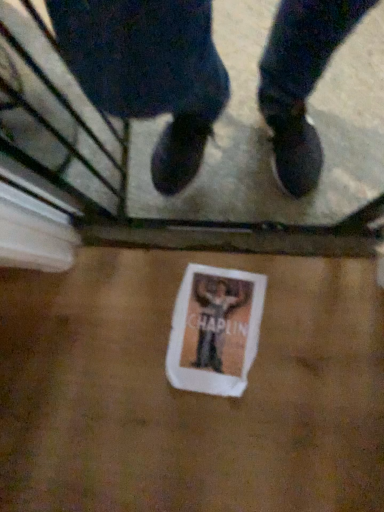
The height and width of the screenshot is (512, 384). What do you see at coordinates (215, 330) in the screenshot?
I see `white paper flyer at center` at bounding box center [215, 330].

Measure the distance between white paper flyer at center and camera.

The distance of white paper flyer at center from camera is 38.30 inches.

In order to click on white paper flyer at center in this screenshot , I will do (x=215, y=330).

What do you see at coordinates (149, 71) in the screenshot? This screenshot has width=384, height=512. I see `matte black shoes at center` at bounding box center [149, 71].

Where is `matte black shoes at center`? This screenshot has height=512, width=384. matte black shoes at center is located at coordinates (149, 71).

The width and height of the screenshot is (384, 512). In order to click on white paper flyer at center in this screenshot , I will do `click(215, 330)`.

Between matte black shoes at center and white paper flyer at center, which one appears on the right side from the viewer's perspective?

matte black shoes at center.

Is matte black shoes at center in front of or behind white paper flyer at center in the image?

In the image, matte black shoes at center appears in front of white paper flyer at center.

Which point is more forward, (176, 70) or (201, 326)?

Point (176, 70)

From the image's perspective, which one is positioned lower, matte black shoes at center or white paper flyer at center?

white paper flyer at center.

From a real-world perspective, is matte black shoes at center positioned over white paper flyer at center based on gravity?

Yes.

Is matte black shoes at center wider than white paper flyer at center?

Incorrect, the width of matte black shoes at center does not surpass that of white paper flyer at center.

Is matte black shoes at center shorter than white paper flyer at center?

Incorrect, the height of matte black shoes at center does not fall short of that of white paper flyer at center.

Is matte black shoes at center bigger than white paper flyer at center?

Indeed, matte black shoes at center has a larger size compared to white paper flyer at center.

Can white paper flyer at center be found inside matte black shoes at center?

No, white paper flyer at center is not surrounded by matte black shoes at center.

Is matte black shoes at center far away from white paper flyer at center?

They are positioned close to each other.

Is matte black shoes at center looking in the opposite direction of white paper flyer at center?

That's right, matte black shoes at center is facing away from white paper flyer at center.

How different are the orientations of matte black shoes at center and white paper flyer at center in degrees?

4.92 degrees separate the facing orientations of matte black shoes at center and white paper flyer at center.

At what (x,y) coordinates should I click in order to perform the action: click on person to the right of white paper flyer at center. Please return your answer as a coordinate pair (x, y). Image resolution: width=384 pixels, height=512 pixels. Looking at the image, I should click on (149, 71).

Is white paper flyer at center to the left of matte black shoes at center from the viewer's perspective?

Yes, white paper flyer at center is to the left of matte black shoes at center.

Is white paper flyer at center further to the viewer compared to matte black shoes at center?

Yes.

Which is behind, point (242, 331) or point (100, 0)?

The point (242, 331) is farther from the camera.

From the image's perspective, which is below, white paper flyer at center or matte black shoes at center?

white paper flyer at center appears lower in the image.

From a real-world perspective, who is located lower, white paper flyer at center or matte black shoes at center?

white paper flyer at center.

Considering the relative sizes of white paper flyer at center and matte black shoes at center in the image provided, is white paper flyer at center thinner than matte black shoes at center?

No, white paper flyer at center is not thinner than matte black shoes at center.

Considering the relative sizes of white paper flyer at center and matte black shoes at center in the image provided, is white paper flyer at center taller than matte black shoes at center?

In fact, white paper flyer at center may be shorter than matte black shoes at center.

Considering the sizes of white paper flyer at center and matte black shoes at center in the image, is white paper flyer at center bigger or smaller than matte black shoes at center?

Considering their sizes, white paper flyer at center takes up less space than matte black shoes at center.

Is white paper flyer at center positioned beyond the bounds of matte black shoes at center?

white paper flyer at center is positioned outside matte black shoes at center.

Is white paper flyer at center placed right next to matte black shoes at center?

No, white paper flyer at center is not beside matte black shoes at center.

Is white paper flyer at center aimed at matte black shoes at center?

No.

What's the angular difference between white paper flyer at center and matte black shoes at center's facing directions?

The facing directions of white paper flyer at center and matte black shoes at center are 4.92 degrees apart.

Measure the distance between white paper flyer at center and matte black shoes at center.

A distance of 38.39 centimeters exists between white paper flyer at center and matte black shoes at center.

You are a GUI agent. You are given a task and a screenshot of the screen. Output one action in this format:
    pyautogui.click(x=<x>, y=<y>)
    Task: Click on the person located above the white paper flyer at center (from the image's perspective)
    This screenshot has height=512, width=384.
    Given the screenshot: What is the action you would take?
    pyautogui.click(x=149, y=71)

Find the location of a particular element. The image size is (384, 512). flyer behind the matte black shoes at center is located at coordinates (215, 330).

At what (x,y) coordinates should I click in order to perform the action: click on person that appears above the white paper flyer at center (from the image's perspective). Please return your answer as a coordinate pair (x, y). Image resolution: width=384 pixels, height=512 pixels. Looking at the image, I should click on click(x=149, y=71).